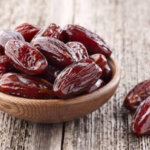
This screenshot has height=150, width=150. Find the location of `line in wood table`. line in wood table is located at coordinates (64, 133).